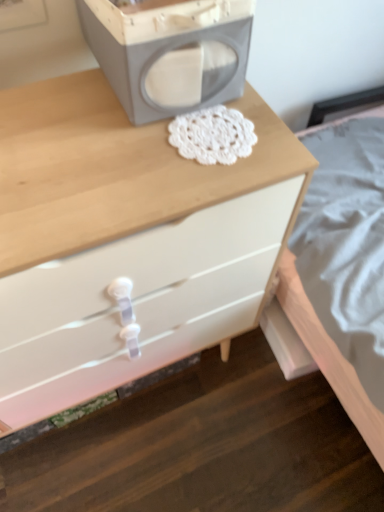
Image resolution: width=384 pixels, height=512 pixels. What do you see at coordinates (169, 52) in the screenshot?
I see `matte gray speaker at upper center` at bounding box center [169, 52].

This screenshot has height=512, width=384. Find the location of `matte gray speaker at upper center`. matte gray speaker at upper center is located at coordinates (169, 52).

The width and height of the screenshot is (384, 512). What do you see at coordinates (126, 240) in the screenshot?
I see `white glossy chest of drawers at center` at bounding box center [126, 240].

Find the location of a particular element. white glossy chest of drawers at center is located at coordinates (126, 240).

Where is `matte gray speaker at upper center`? matte gray speaker at upper center is located at coordinates (169, 52).

Between matte gray speaker at upper center and white glossy chest of drawers at center, which one appears on the right side from the viewer's perspective?

Positioned to the right is matte gray speaker at upper center.

Which object is closer to the camera, matte gray speaker at upper center or white glossy chest of drawers at center?

white glossy chest of drawers at center is in front.

Does point (174, 60) appear closer or farther from the camera than point (10, 350)?

Point (174, 60).

Consider the image. From the image's perspective, between matte gray speaker at upper center and white glossy chest of drawers at center, who is located below?

white glossy chest of drawers at center is shown below in the image.

From a real-world perspective, is matte gray speaker at upper center under white glossy chest of drawers at center?

Incorrect, from a real-world perspective, matte gray speaker at upper center is higher than white glossy chest of drawers at center.

Is matte gray speaker at upper center wider than white glossy chest of drawers at center?

Incorrect, the width of matte gray speaker at upper center does not surpass that of white glossy chest of drawers at center.

Considering the sizes of objects matte gray speaker at upper center and white glossy chest of drawers at center in the image provided, who is shorter, matte gray speaker at upper center or white glossy chest of drawers at center?

Standing shorter between the two is matte gray speaker at upper center.

Can you confirm if matte gray speaker at upper center is smaller than white glossy chest of drawers at center?

Yes, matte gray speaker at upper center is smaller than white glossy chest of drawers at center.

Is matte gray speaker at upper center not within white glossy chest of drawers at center?

Yes, matte gray speaker at upper center is not within white glossy chest of drawers at center.

Looking at this image, is matte gray speaker at upper center not near white glossy chest of drawers at center?

No, matte gray speaker at upper center is not far away from white glossy chest of drawers at center.

Is matte gray speaker at upper center turned away from white glossy chest of drawers at center?

matte gray speaker at upper center is not turned away from white glossy chest of drawers at center.

Image resolution: width=384 pixels, height=512 pixels. In order to click on chest of drawers that appears on the left of matte gray speaker at upper center in this screenshot , I will do `click(126, 240)`.

Visually, is white glossy chest of drawers at center positioned to the left or to the right of matte gray speaker at upper center?

Clearly, white glossy chest of drawers at center is on the left of matte gray speaker at upper center in the image.

Consider the image. Between white glossy chest of drawers at center and matte gray speaker at upper center, which one is positioned in front?

white glossy chest of drawers at center.

Which is in front, point (259, 278) or point (157, 84)?

The point (157, 84) is more forward.

From the image's perspective, is white glossy chest of drawers at center below matte gray speaker at upper center?

Indeed, from the image's perspective, white glossy chest of drawers at center is shown beneath matte gray speaker at upper center.

From a real-world perspective, which object stands above the other?

matte gray speaker at upper center, from a real-world perspective.

Is white glossy chest of drawers at center wider than matte gray speaker at upper center?

Indeed, white glossy chest of drawers at center has a greater width compared to matte gray speaker at upper center.

Considering the sizes of white glossy chest of drawers at center and matte gray speaker at upper center in the image, is white glossy chest of drawers at center taller or shorter than matte gray speaker at upper center?

In the image, white glossy chest of drawers at center appears to be taller than matte gray speaker at upper center.

Looking at the image, does white glossy chest of drawers at center seem bigger or smaller compared to matte gray speaker at upper center?

Considering their sizes, white glossy chest of drawers at center takes up more space than matte gray speaker at upper center.

Is white glossy chest of drawers at center not within matte gray speaker at upper center?

white glossy chest of drawers at center lies outside matte gray speaker at upper center's area.

Is white glossy chest of drawers at center directly adjacent to matte gray speaker at upper center?

white glossy chest of drawers at center is not next to matte gray speaker at upper center, and they're not touching.

From the picture: Is white glossy chest of drawers at center looking in the opposite direction of matte gray speaker at upper center?

white glossy chest of drawers at center does not have its back to matte gray speaker at upper center.

You are a GUI agent. You are given a task and a screenshot of the screen. Output one action in this format:
    pyautogui.click(x=<x>, y=<y>)
    Task: Click on the appliance above the white glossy chest of drawers at center (from the image's perspective)
    The image size is (384, 512).
    Given the screenshot: What is the action you would take?
    pyautogui.click(x=169, y=52)

This screenshot has height=512, width=384. I want to click on appliance above the white glossy chest of drawers at center (from a real-world perspective), so click(x=169, y=52).

At what (x,y) coordinates should I click in order to perform the action: click on appliance above the white glossy chest of drawers at center (from the image's perspective). Please return your answer as a coordinate pair (x, y). Looking at the image, I should click on (169, 52).